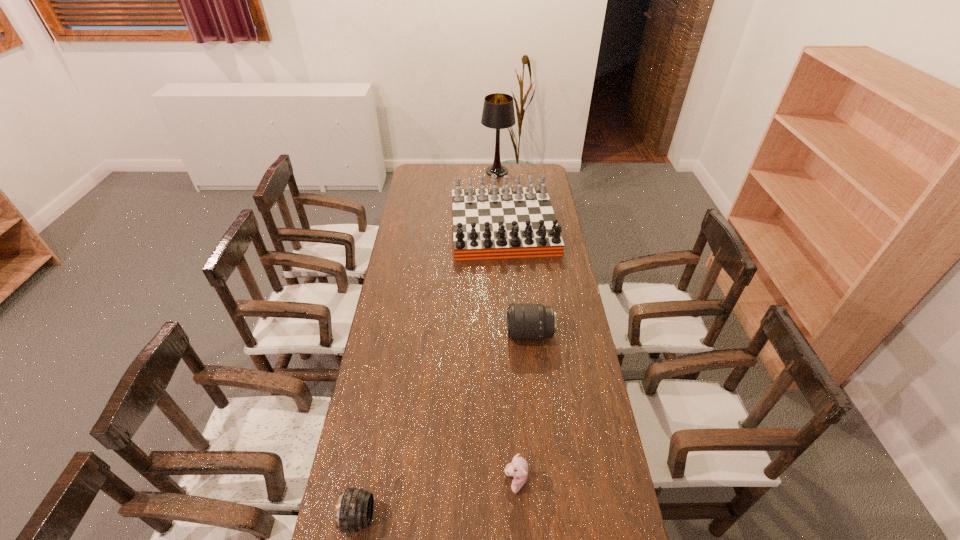
Image resolution: width=960 pixels, height=540 pixels. I want to click on vacant region located 0.280m on the front of the fourth nearest object, so click(x=509, y=306).

Find the location of a particular element. vacant space located on the surface of the third farthest object is located at coordinates (489, 334).

You are a GUI agent. You are given a task and a screenshot of the screen. Output one action in this format:
    pyautogui.click(x=<x>, y=<y>)
    Task: Click on the vacant space located on the surface of the third farthest object
    The height and width of the screenshot is (540, 960).
    Given the screenshot: What is the action you would take?
    pyautogui.click(x=459, y=334)

The height and width of the screenshot is (540, 960). I want to click on vacant point located 0.120m on the surface of the third farthest object, so click(475, 334).

Image resolution: width=960 pixels, height=540 pixels. Find the location of `vacant space situated 0.380m at the face of the teddy bear`. vacant space situated 0.380m at the face of the teddy bear is located at coordinates (372, 482).

I want to click on vacant region located at the face of the teddy bear, so click(x=399, y=482).

Find the location of a particular element. free space located at the face of the teddy bear is located at coordinates (385, 482).

At what (x,y) coordinates should I click in order to perform the action: click on free space located at the front element of the shorter telephoto lens. Please return your answer as a coordinate pair (x, y). The width and height of the screenshot is (960, 540). Looking at the image, I should click on tap(414, 517).

Locate an element on the screen. The width and height of the screenshot is (960, 540). object that is at the far edge is located at coordinates (498, 113).

At what (x,y) coordinates should I click in order to perform the action: click on object positioned at the left edge. Please return your answer as a coordinate pair (x, y). Image resolution: width=960 pixels, height=540 pixels. Looking at the image, I should click on (354, 510).